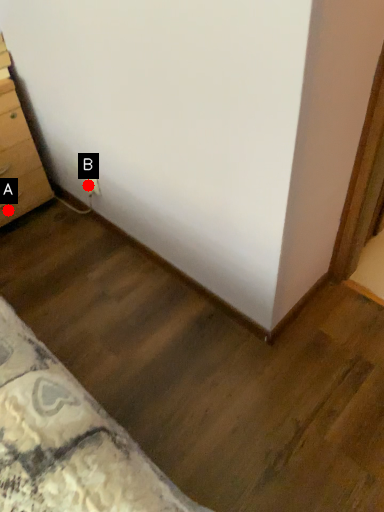
Question: Two points are circled on the image, labeled by A and B beside each circle. Which point is closer to the camera?

Choices:
 (A) A is closer
 (B) B is closer

Answer: (B)